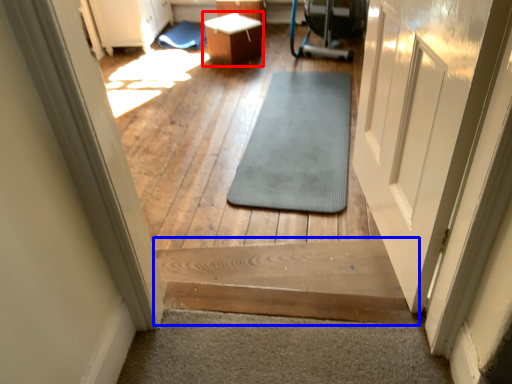
Question: Which object appears farthest to the camera in this image, table (highlighted by a red box) or stairs (highlighted by a blue box)?

Choices:
 (A) table
 (B) stairs

Answer: (A)